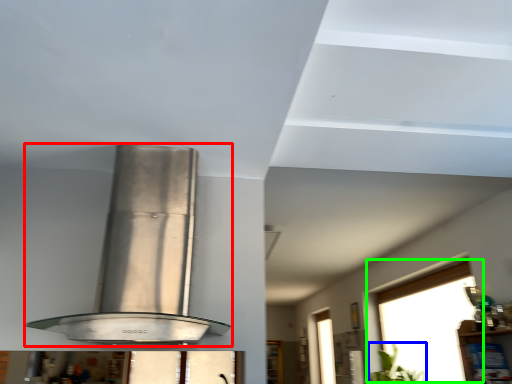
Question: Which is farther away from kitchen appliance (highlighted by a red box)? plant (highlighted by a blue box) or window (highlighted by a green box)?

Choices:
 (A) plant
 (B) window

Answer: (A)